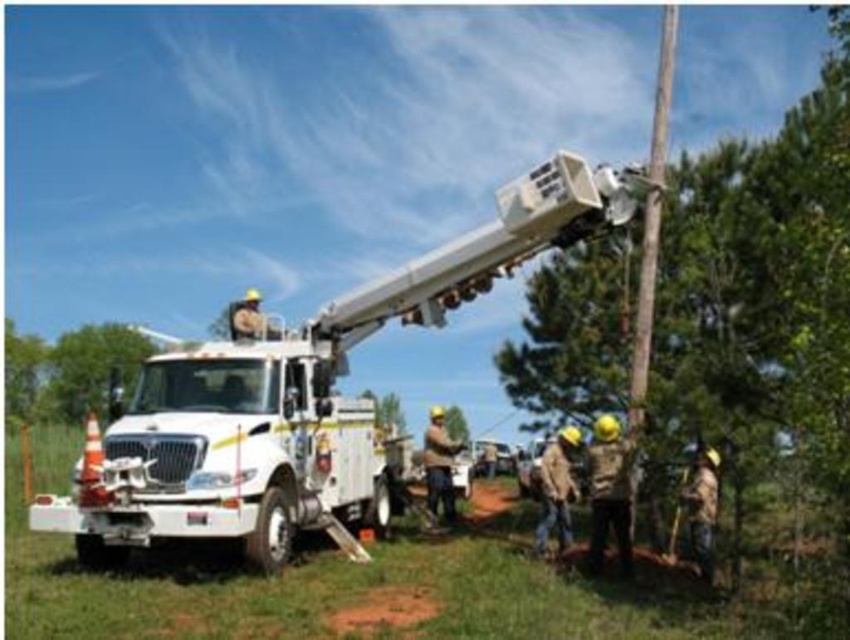
Question: Estimate the real-world distances between objects in this image. Which object is farther from the brown leather gloves at center?

Choices:
 (A) green leafy tree at lower left
 (B) white metallic bucket truck at center
 (C) green leafy tree at left

Answer: (A)

Question: Which point is closer to the camera taking this photo?

Choices:
 (A) (94, 326)
 (B) (8, 388)

Answer: (A)

Question: Does white metallic bucket truck at center have a smaller size compared to green leafy tree at lower left?

Choices:
 (A) no
 (B) yes

Answer: (B)

Question: Is green leafy tree at lower left below brown leather gloves at center?

Choices:
 (A) yes
 (B) no

Answer: (B)

Question: Which object appears closest to the camera in this image?

Choices:
 (A) green textured tree at center
 (B) white metallic bucket truck at center
 (C) green leafy tree at left

Answer: (A)

Question: From the image, what is the correct spatial relationship of white metallic bucket truck at center in relation to green leafy tree at left?

Choices:
 (A) above
 (B) below

Answer: (A)